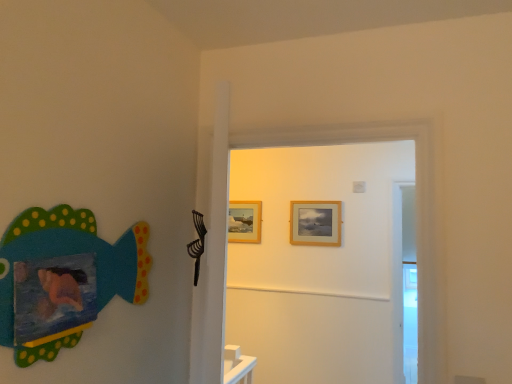
Question: From a real-world perspective, is matte painted fish at left over wooden door at center?

Choices:
 (A) yes
 (B) no

Answer: (B)

Question: Is matte painted fish at left outside of wooden door at center?

Choices:
 (A) yes
 (B) no

Answer: (A)

Question: Does matte painted fish at left appear on the right side of wooden door at center?

Choices:
 (A) no
 (B) yes

Answer: (A)

Question: Can you confirm if matte painted fish at left is bigger than wooden door at center?

Choices:
 (A) no
 (B) yes

Answer: (A)

Question: Is matte painted fish at left shorter than wooden door at center?

Choices:
 (A) yes
 (B) no

Answer: (A)

Question: Is wooden door at center inside the boundaries of wooden picture frame at upper center, which is the first picture frame from right to left, or outside?

Choices:
 (A) outside
 (B) inside

Answer: (A)

Question: Considering their positions, is wooden door at center located in front of or behind wooden picture frame at upper center, the second picture frame from the left?

Choices:
 (A) front
 (B) behind

Answer: (A)

Question: Looking at their shapes, would you say wooden door at center is wider or thinner than wooden picture frame at upper center, which is the first picture frame from right to left?

Choices:
 (A) wide
 (B) thin

Answer: (A)

Question: Considering the positions of wooden door at center and wooden picture frame at upper center, placed as the 1th picture frame when sorted from front to back, in the image, is wooden door at center bigger or smaller than wooden picture frame at upper center, placed as the 1th picture frame when sorted from front to back,?

Choices:
 (A) big
 (B) small

Answer: (A)

Question: Is wooden door at center in front of or behind matte painted fish at left in the image?

Choices:
 (A) behind
 (B) front

Answer: (A)

Question: From a real-world perspective, is wooden door at center above or below matte painted fish at left?

Choices:
 (A) below
 (B) above

Answer: (B)

Question: In terms of width, does wooden door at center look wider or thinner when compared to matte painted fish at left?

Choices:
 (A) thin
 (B) wide

Answer: (B)

Question: Does point (433, 253) appear closer or farther from the camera than point (15, 233)?

Choices:
 (A) closer
 (B) farther

Answer: (B)

Question: Looking at their shapes, would you say wooden door at center is wider or thinner than wooden picture frame at center, which is the first picture frame in left-to-right order?

Choices:
 (A) thin
 (B) wide

Answer: (B)

Question: Is wooden door at center inside or outside of wooden picture frame at center, placed as the first picture frame when sorted from back to front?

Choices:
 (A) outside
 (B) inside

Answer: (A)